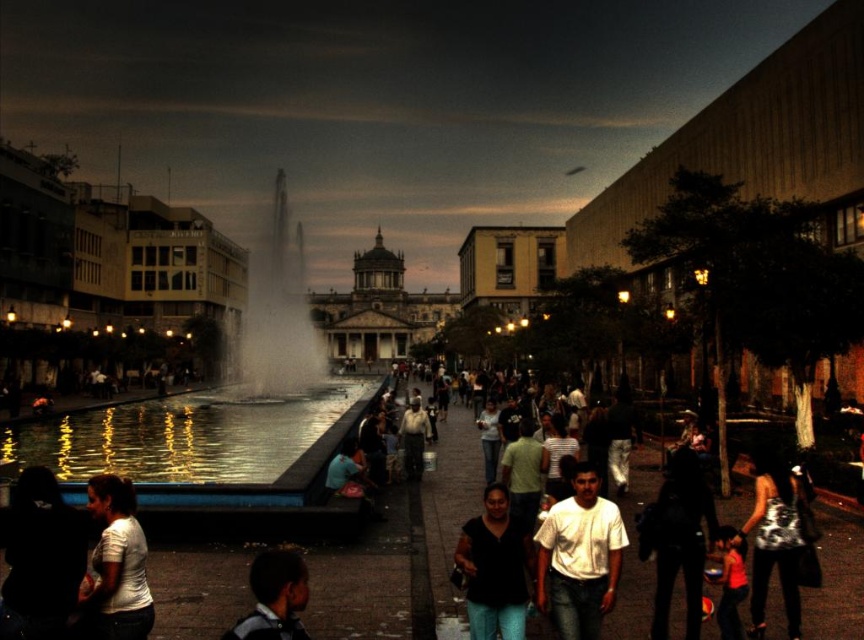
Question: Estimate the real-world distances between objects in this image. Which object is farther from the shiny silver tank top at lower right?

Choices:
 (A) dark fabric shirt at lower left
 (B) dark skin human head at lower center
 (C) reflective glass waterway at center
 (D) white matte shirt at lower left

Answer: (C)

Question: Can you confirm if white matte shirt at center is positioned above dark skin human head at lower center?

Choices:
 (A) yes
 (B) no

Answer: (A)

Question: Which point appears farthest from the camera in this image?

Choices:
 (A) (516, 566)
 (B) (141, 605)
 (C) (791, 577)

Answer: (A)

Question: Does reflective glass waterway at center appear on the right side of shiny silver tank top at lower right?

Choices:
 (A) yes
 (B) no

Answer: (B)

Question: Which is nearer to the white matte shirt at center?

Choices:
 (A) white matte shirt at lower left
 (B) shiny silver tank top at lower right

Answer: (B)

Question: Can you confirm if reflective glass waterway at center is wider than shiny silver tank top at lower right?

Choices:
 (A) yes
 (B) no

Answer: (A)